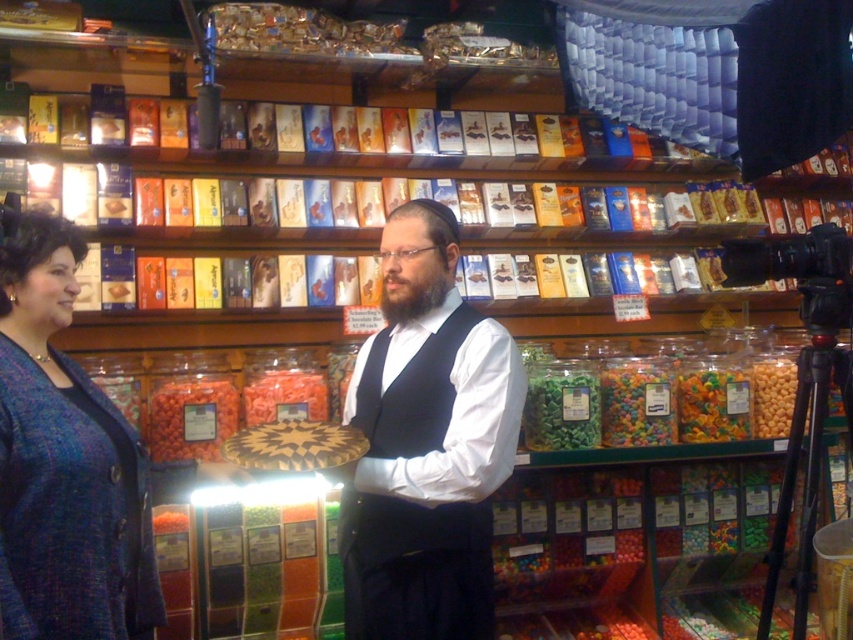
Which is behind, point (659, 444) or point (263, 372)?

The point (659, 444) is behind.

Can you confirm if translucent rubber gummy bears at center is smaller than translucent orange gummy bears at center?

No.

Locate an element on the screen. The height and width of the screenshot is (640, 853). translucent rubber gummy bears at center is located at coordinates (637, 403).

Locate an element on the screen. translucent rubber gummy bears at center is located at coordinates (637, 403).

Describe the element at coordinates (65, 465) in the screenshot. The height and width of the screenshot is (640, 853). I see `blue textured sweater at left` at that location.

Can you confirm if blue textured sweater at left is positioned to the right of translucent plastic gummy bears at center?

Incorrect, blue textured sweater at left is not on the right side of translucent plastic gummy bears at center.

Who is more distant from viewer, (28, 589) or (704, 429)?

Positioned behind is point (704, 429).

Where is `blue textured sweater at left`? blue textured sweater at left is located at coordinates (65, 465).

Which of these two, translucent plastic gummy bears at center or translucent orange gummy bears at center, stands taller?

translucent plastic gummy bears at center

Describe the element at coordinates (712, 401) in the screenshot. Image resolution: width=853 pixels, height=640 pixels. I see `translucent plastic gummy bears at center` at that location.

Describe the element at coordinates (712, 401) in the screenshot. I see `translucent plastic gummy bears at center` at that location.

Where is `translucent plastic gummy bears at center`? translucent plastic gummy bears at center is located at coordinates (712, 401).